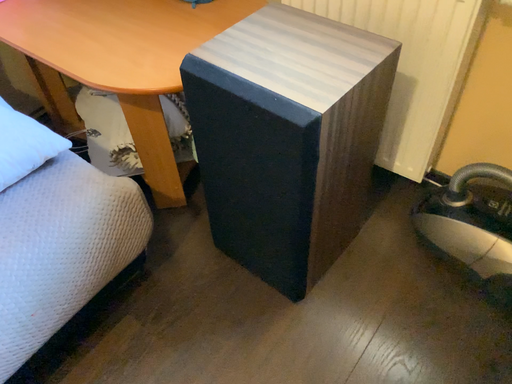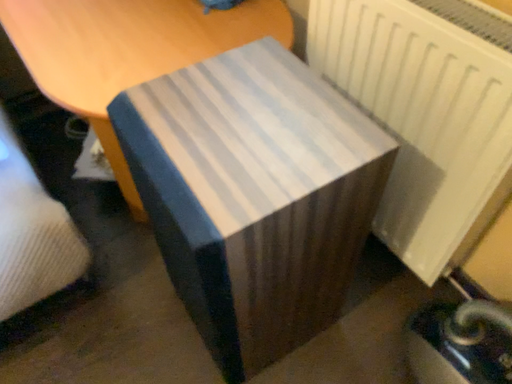
Question: Which way did the camera rotate in the video?

Choices:
 (A) rotated left
 (B) rotated right

Answer: (A)